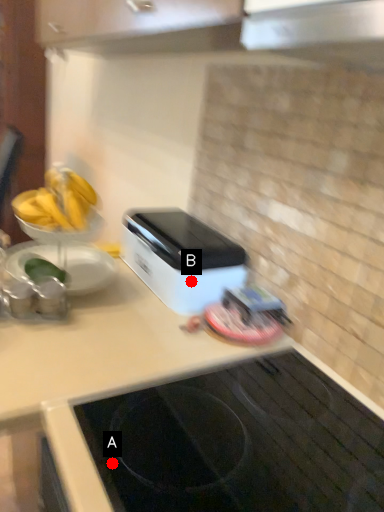
Question: Two points are circled on the image, labeled by A and B beside each circle. Among these points, which one is farthest from the camera?

Choices:
 (A) A is further
 (B) B is further

Answer: (B)